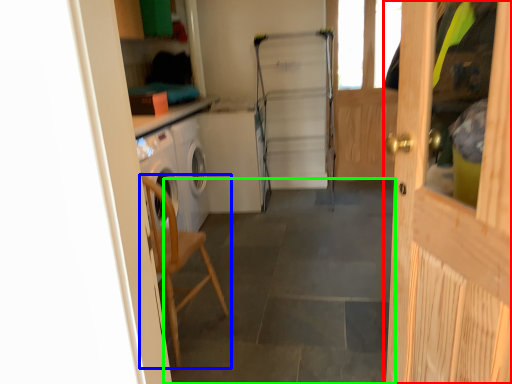
Question: Which is farther away from door (highlighted by a red box)? chair (highlighted by a blue box) or concrete (highlighted by a green box)?

Choices:
 (A) chair
 (B) concrete

Answer: (A)